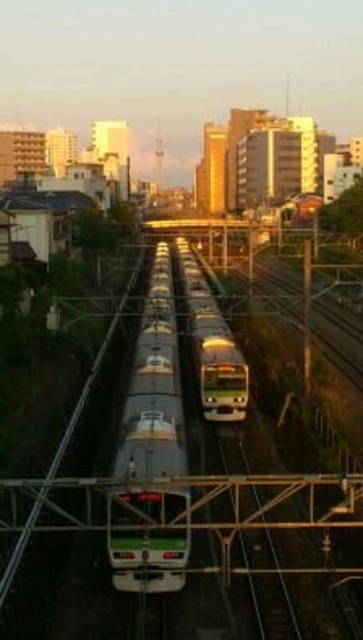
Question: Which of the following is the closest to the observer?

Choices:
 (A) silver metallic train at center
 (B) green metallic train at center

Answer: (A)

Question: Among these points, which one is nearest to the camera?

Choices:
 (A) (162, 340)
 (B) (201, 364)

Answer: (B)

Question: Does silver metallic train at center lie in front of green metallic train at center?

Choices:
 (A) no
 (B) yes

Answer: (B)

Question: Can you confirm if silver metallic train at center is thinner than green metallic train at center?

Choices:
 (A) no
 (B) yes

Answer: (B)

Question: Is silver metallic train at center above green metallic train at center?

Choices:
 (A) no
 (B) yes

Answer: (A)

Question: Which point is closer to the camera taking this photo?

Choices:
 (A) (169, 544)
 (B) (214, 358)

Answer: (A)